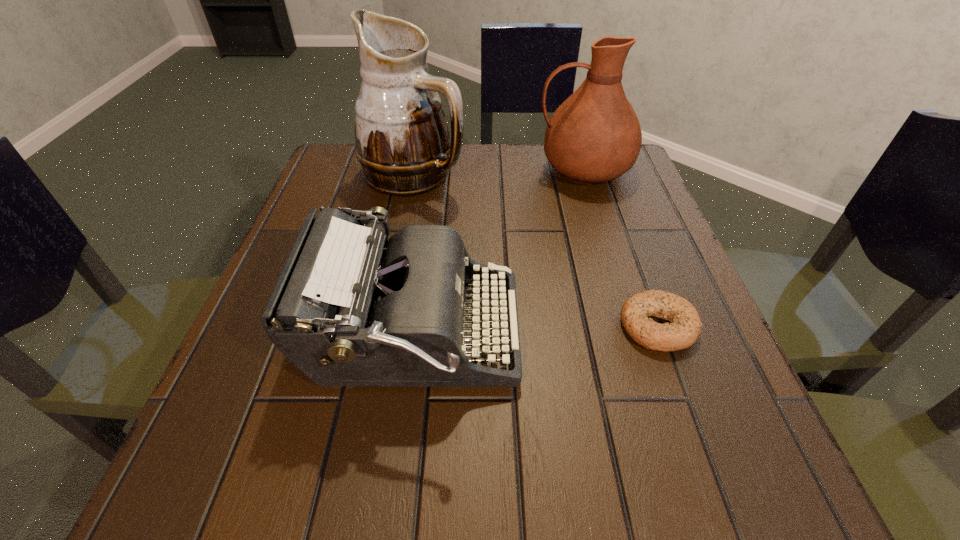
In the image, there is a desktop. Where is `vacant space at the far right corner`? This screenshot has height=540, width=960. vacant space at the far right corner is located at coordinates (631, 180).

The image size is (960, 540). I want to click on free space between the third tallest object and the right pitcher, so click(x=499, y=252).

This screenshot has height=540, width=960. Find the location of `free spot between the bagel and the right pitcher`. free spot between the bagel and the right pitcher is located at coordinates (620, 248).

You are a GUI agent. You are given a task and a screenshot of the screen. Output one action in this format:
    pyautogui.click(x=<x>, y=<y>)
    Task: Click on the blank region between the bagel and the typewriter
    The image size is (960, 540).
    Given the screenshot: What is the action you would take?
    pyautogui.click(x=536, y=330)

At what (x,y) coordinates should I click in order to perform the action: click on free space between the third tallest object and the right pitcher. Please return your answer as a coordinate pair (x, y). Image resolution: width=960 pixels, height=540 pixels. Looking at the image, I should click on (499, 252).

You are a GUI agent. You are given a task and a screenshot of the screen. Output one action in this format:
    pyautogui.click(x=<x>, y=<y>)
    Task: Click on the free space between the shortest object and the right pitcher
    
    Given the screenshot: What is the action you would take?
    pyautogui.click(x=620, y=248)

Locate an element on the screen. The width and height of the screenshot is (960, 540). blank region between the bagel and the right pitcher is located at coordinates (620, 248).

The image size is (960, 540). I want to click on unoccupied position between the right pitcher and the shortest object, so click(620, 248).

Identify the location of vacant area that lies between the third tallest object and the shortest object. [x=536, y=330].

In order to click on unoccupied position between the right pitcher and the shortest object in this screenshot , I will do `click(620, 248)`.